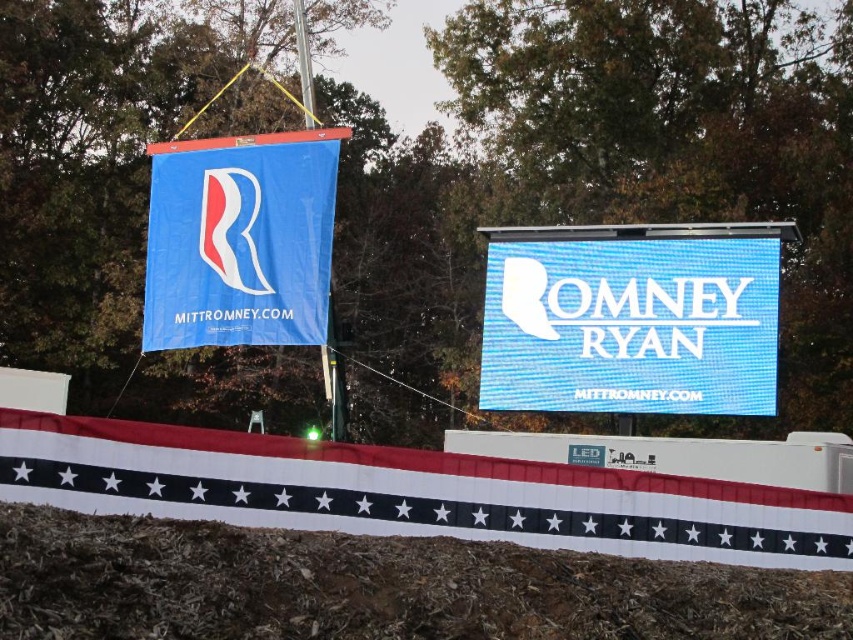
At what (x,y) coordinates should I click in order to perform the action: click on white fabric banner at lower center. Please return your answer as a coordinate pair (x, y). This screenshot has height=640, width=853. Looking at the image, I should click on (412, 492).

Which of these two, white fabric banner at lower center or blue fabric banner at upper left, stands shorter?

white fabric banner at lower center

Is point (630, 476) closer to camera compared to point (229, 200)?

Yes, point (630, 476) is closer to viewer.

The height and width of the screenshot is (640, 853). Find the location of `white fabric banner at lower center`. white fabric banner at lower center is located at coordinates (412, 492).

Does blue mesh sign at center have a lesser height compared to blue fabric banner at upper left?

Yes, blue mesh sign at center is shorter than blue fabric banner at upper left.

Who is shorter, blue mesh sign at center or blue fabric banner at upper left?

blue mesh sign at center is shorter.

What do you see at coordinates (631, 324) in the screenshot? The image size is (853, 640). I see `blue mesh sign at center` at bounding box center [631, 324].

Where is `blue mesh sign at center`? The width and height of the screenshot is (853, 640). blue mesh sign at center is located at coordinates (631, 324).

Can you confirm if white fabric banner at lower center is taller than blue mesh sign at center?

Incorrect, white fabric banner at lower center's height is not larger of blue mesh sign at center's.

Is white fabric banner at lower center smaller than blue mesh sign at center?

Incorrect, white fabric banner at lower center is not smaller in size than blue mesh sign at center.

Between point (683, 522) and point (757, 396), which one is positioned behind?

The point (757, 396) is more distant.

Locate an element on the screen. The image size is (853, 640). white fabric banner at lower center is located at coordinates (412, 492).